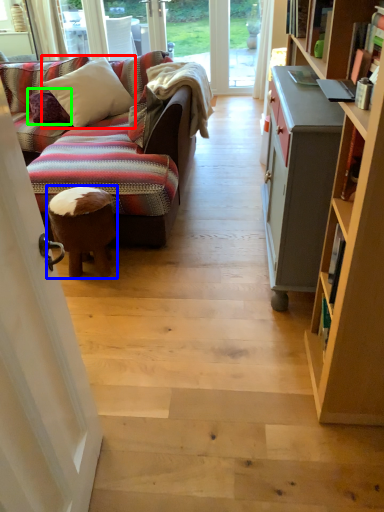
Question: Estimate the real-world distances between objects in this image. Which object is closer to pillow (highlighted by a red box), stool (highlighted by a blue box) or pillow (highlighted by a green box)?

Choices:
 (A) stool
 (B) pillow

Answer: (B)